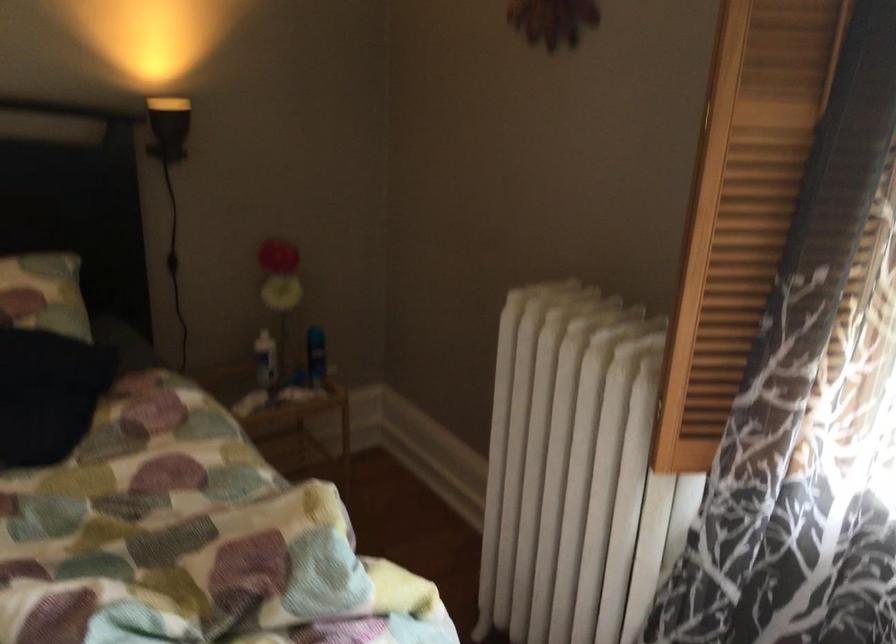
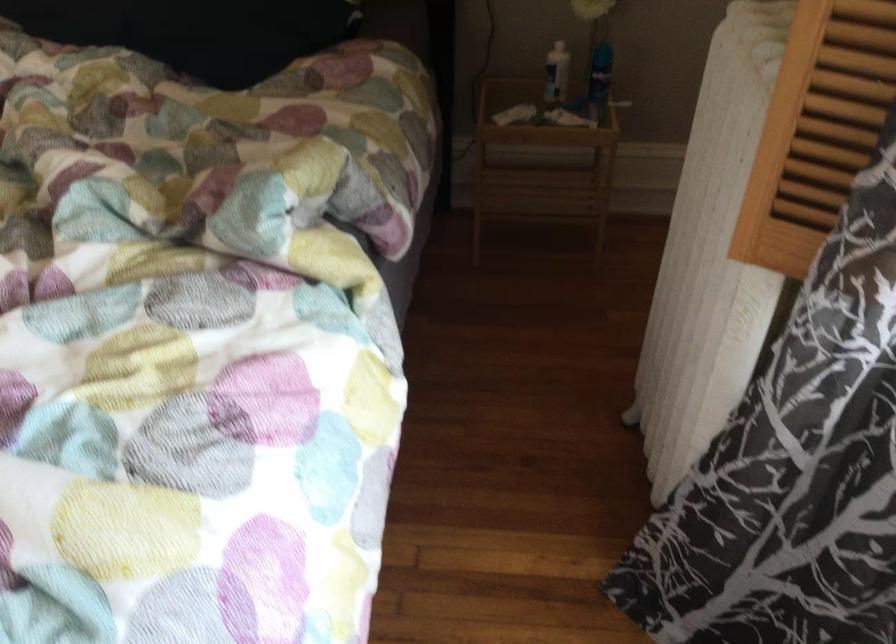
The point at (280, 355) is marked in the first image. Where is the corresponding point in the second image?

(556, 73)